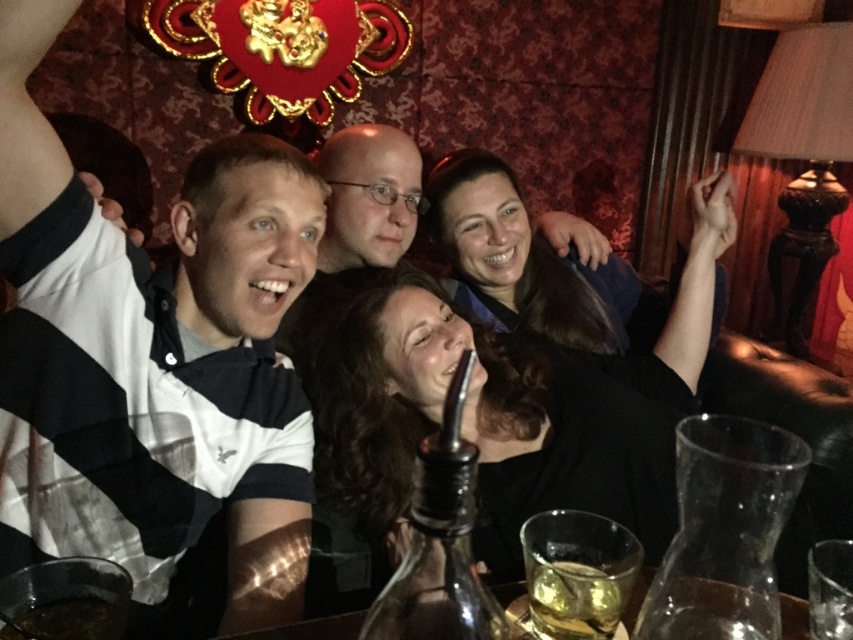
Question: Which object is farther from the camera taking this photo?

Choices:
 (A) brown liquid at lower left
 (B) translucent glass at center

Answer: (B)

Question: Does translucent glass at center have a lesser width compared to brown liquid at lower left?

Choices:
 (A) yes
 (B) no

Answer: (A)

Question: Is translucent glass at center smaller than brown liquid at lower left?

Choices:
 (A) yes
 (B) no

Answer: (B)

Question: Is translucent glass at center closer to the viewer compared to brown liquid at lower left?

Choices:
 (A) yes
 (B) no

Answer: (B)